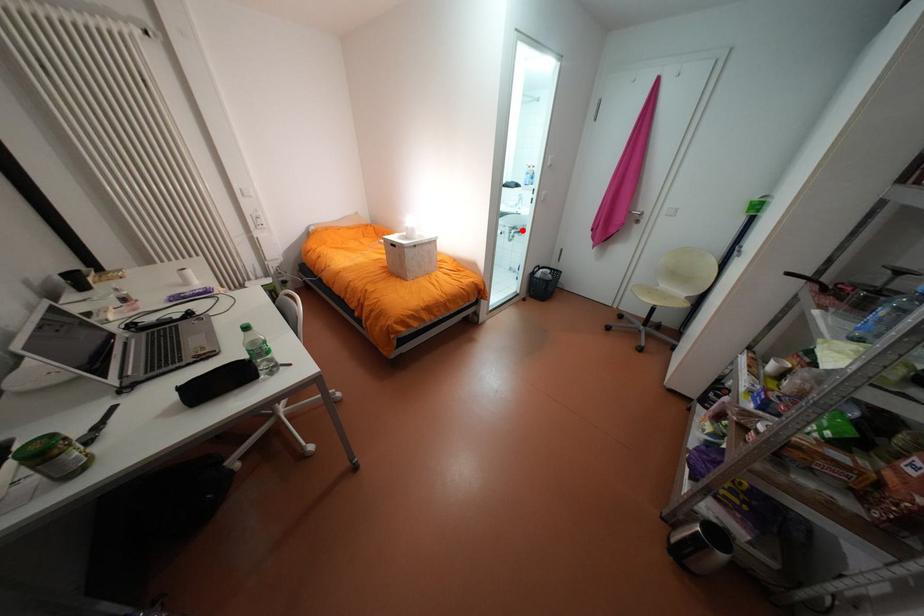
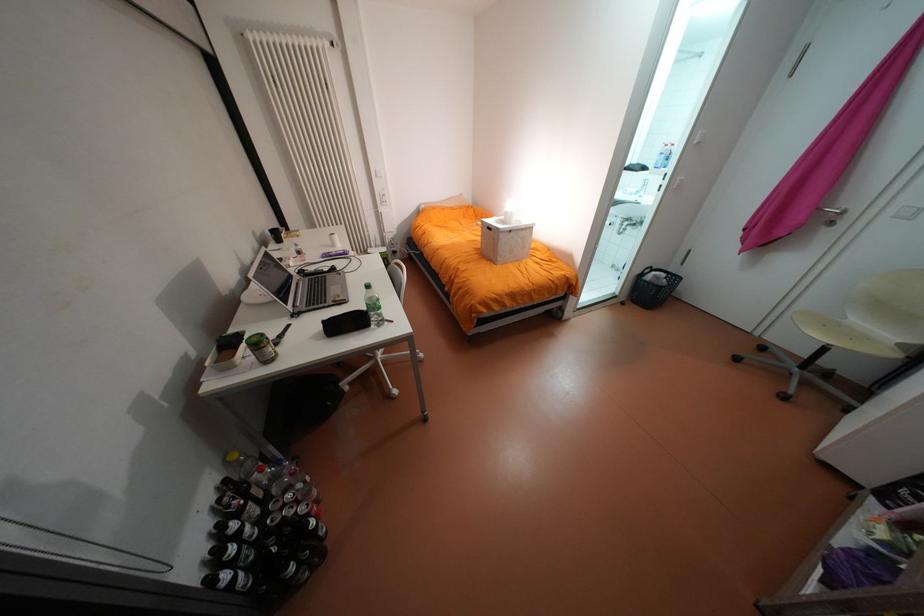
Where in the second image is the point corresponding to the highlighted location from the first image?

(636, 223)